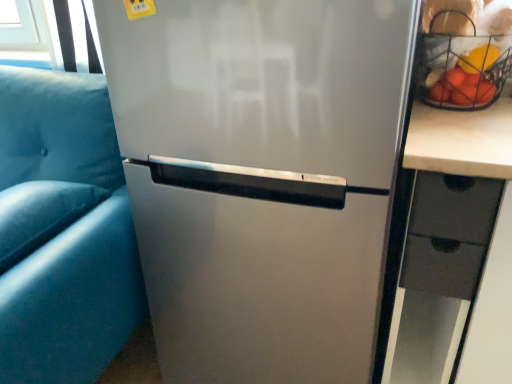
Question: Is suede-like blue pillow at left bigger or smaller than matte black drawer at right?

Choices:
 (A) big
 (B) small

Answer: (A)

Question: Considering the positions of suede-like blue pillow at left and matte black drawer at right in the image, is suede-like blue pillow at left taller or shorter than matte black drawer at right?

Choices:
 (A) short
 (B) tall

Answer: (A)

Question: Based on their relative distances, which object is nearer to the metallic wire basket at upper right?

Choices:
 (A) matte black drawer at right
 (B) matte blue armchair at left
 (C) suede-like blue pillow at left
 (D) satin silver refrigerator at center

Answer: (A)

Question: Estimate the real-world distances between objects in this image. Which object is farther from the satin silver refrigerator at center?

Choices:
 (A) matte blue armchair at left
 (B) matte black drawer at right
 (C) suede-like blue pillow at left
 (D) metallic wire basket at upper right

Answer: (D)